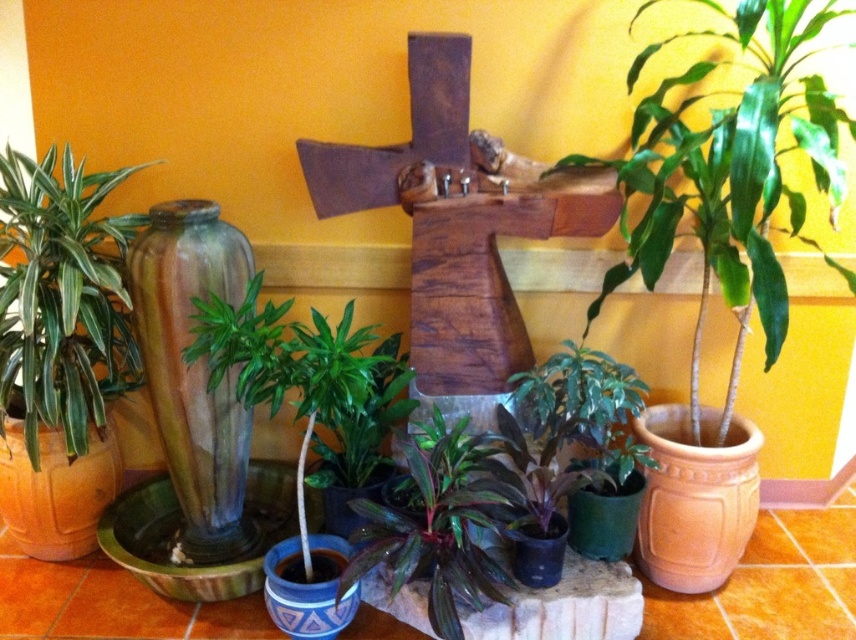
Question: Is matte glass vase at left thinner than green matte vase at lower right?

Choices:
 (A) no
 (B) yes

Answer: (A)

Question: Which object is the farthest from the matte blue vase at center?

Choices:
 (A) green glossy vase at center-left
 (B) matte glass vase at left

Answer: (B)

Question: Which object appears closest to the camera in this image?

Choices:
 (A) green glossy vase at center-left
 (B) blue ceramic vase at center
 (C) matte blue vase at center
 (D) wooden cross at center

Answer: (A)

Question: Does wooden cross at center appear over matte blue vase at center?

Choices:
 (A) yes
 (B) no

Answer: (A)

Question: Which of the following is the farthest from the observer?

Choices:
 (A) (54, 300)
 (B) (709, 273)
 (C) (306, 612)

Answer: (B)

Question: From the image, what is the correct spatial relationship of green glossy plant at upper right in relation to wooden cross at center?

Choices:
 (A) left
 (B) right

Answer: (B)